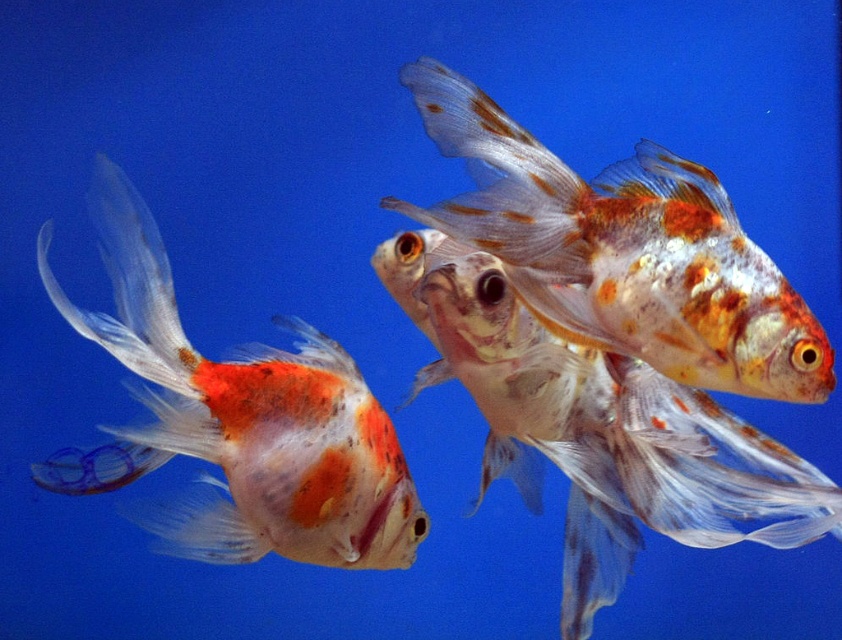
You are observing three goldfish against a blue background. You notice two specific points labeled as point (254, 531) and point (672, 461). Which of these points is closer to you?

Point (254, 531) is further to the camera than point (672, 461), so the point closer to you is point (672, 461).

Looking at the three goldfish in the blue background, where is the translucent orange goldfish at center relative to the speckled orange and white goldfish at center?

The translucent orange goldfish at center is to the left of the speckled orange and white goldfish at center.

You are an underwater photographer aiming to capture the translucent orange goldfish at center and the speckled orange and white goldfish at center in a single shot. Which goldfish will appear closer to the camera in your photo?

The translucent orange goldfish at center will appear closer to the camera because the speckled orange and white goldfish at center is behind it.